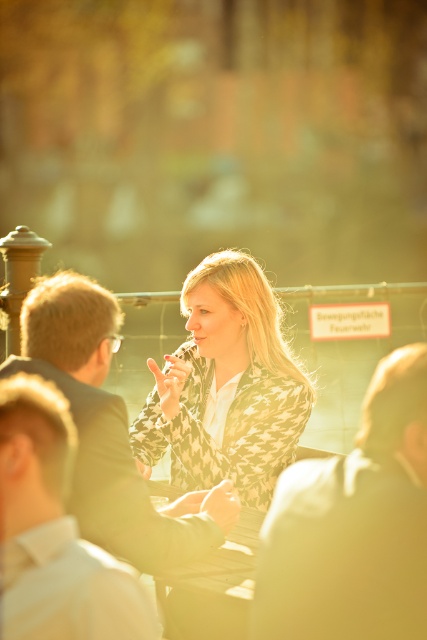
Question: Is dark suit jacket at center above patterned fabric jacket at center?

Choices:
 (A) no
 (B) yes

Answer: (A)

Question: Which point is closer to the camera taking this photo?

Choices:
 (A) (377, 627)
 (B) (5, 541)

Answer: (A)

Question: Which object appears farthest from the camera in this image?

Choices:
 (A) patterned fabric jacket at center
 (B) matte black suit at center

Answer: (A)

Question: Which object is the farthest from the matte black suit at center?

Choices:
 (A) white shirt at center
 (B) green matte table at center
 (C) patterned fabric jacket at center

Answer: (C)

Question: Is dark suit jacket at center thinner than matte black suit at center?

Choices:
 (A) no
 (B) yes

Answer: (B)

Question: Does dark suit jacket at center appear under green matte table at center?

Choices:
 (A) yes
 (B) no

Answer: (B)